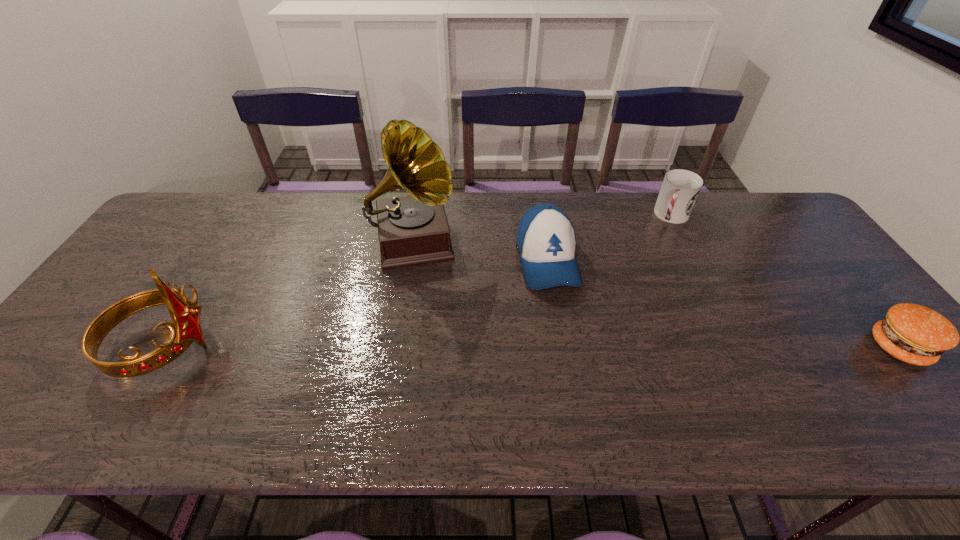
Locate which object is the fourth closest to the tiara. Please provide its 2D coordinates. Your answer should be formatted as a tuple, i.e. [(x, y)], where the tuple contains the x and y coordinates of a point satisfying the conditions above.

[(912, 333)]

Locate which object is the closest to the third object from left to right. Please provide its 2D coordinates. Your answer should be formatted as a tuple, i.e. [(x, y)], where the tuple contains the x and y coordinates of a point satisfying the conditions above.

[(414, 229)]